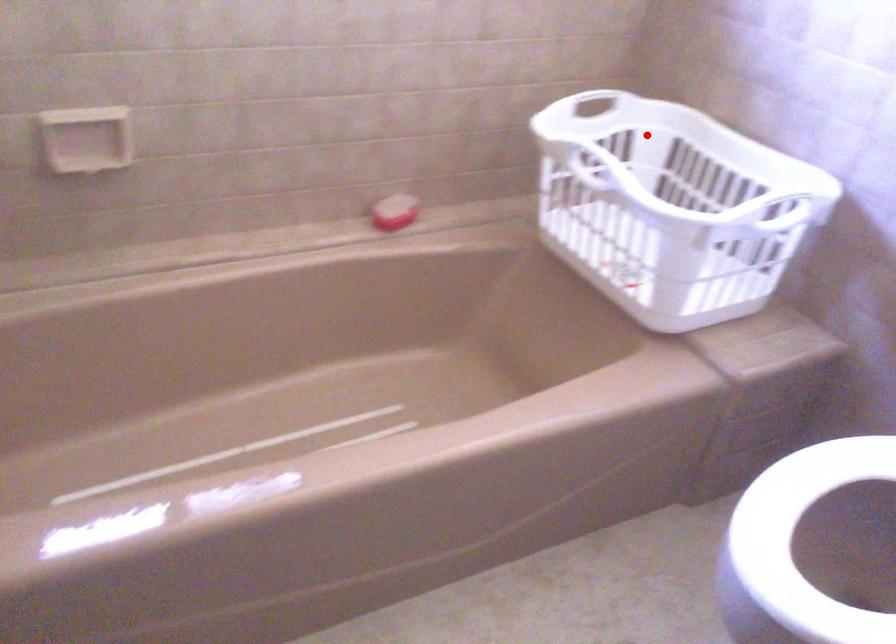
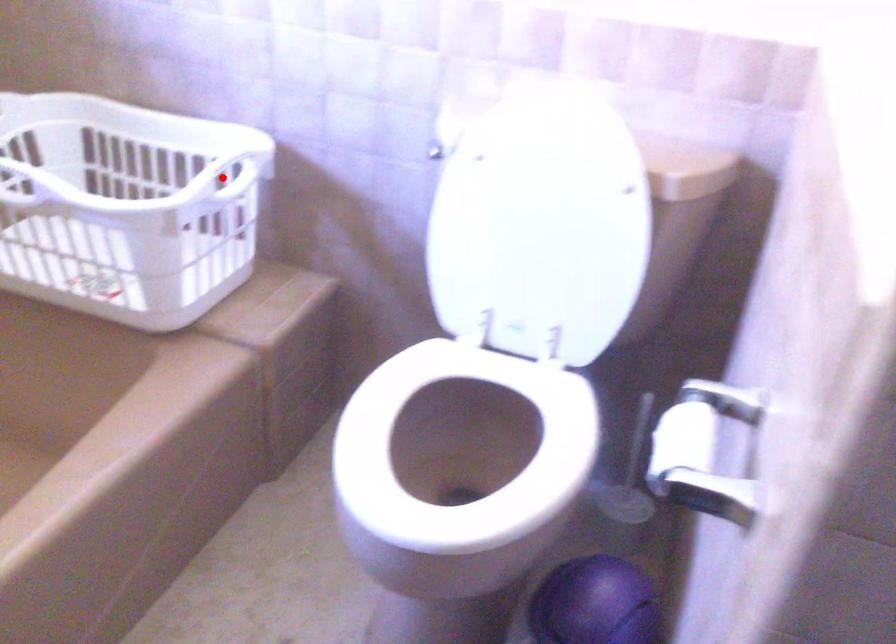
I am providing you with two images of the same scene from different viewpoints. A red point is marked on the first image and another point is marked on the second image. Does the point marked in image1 correspond to the same location as the one in image2?

No